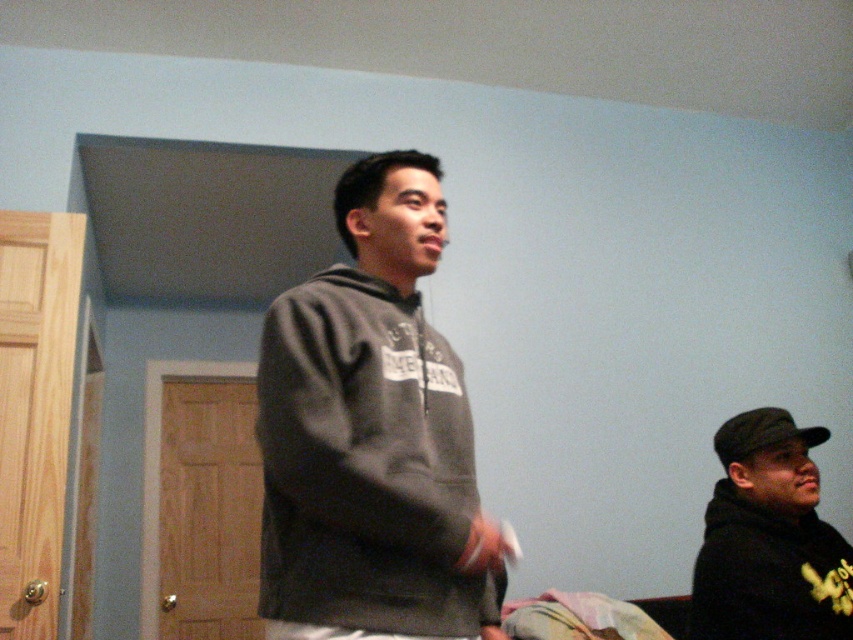
You are standing in the room shown in the image and want to reach a point that is 3.66 feet away from you. Can you confirm if the point at coordinates point (316, 333) is exactly at that distance?

The point (316, 333) is exactly 3.66 feet away from the viewer, so yes, the point at coordinates point (316, 333) is exactly at that distance.

You are trying to decide which hoodie to wear based on their thickness. The scene shows a dark gray hoodie at center and a black matte hoodie at lower right. Which one is thinner?

The dark gray hoodie at center is thinner than the black matte hoodie at lower right according to the description.